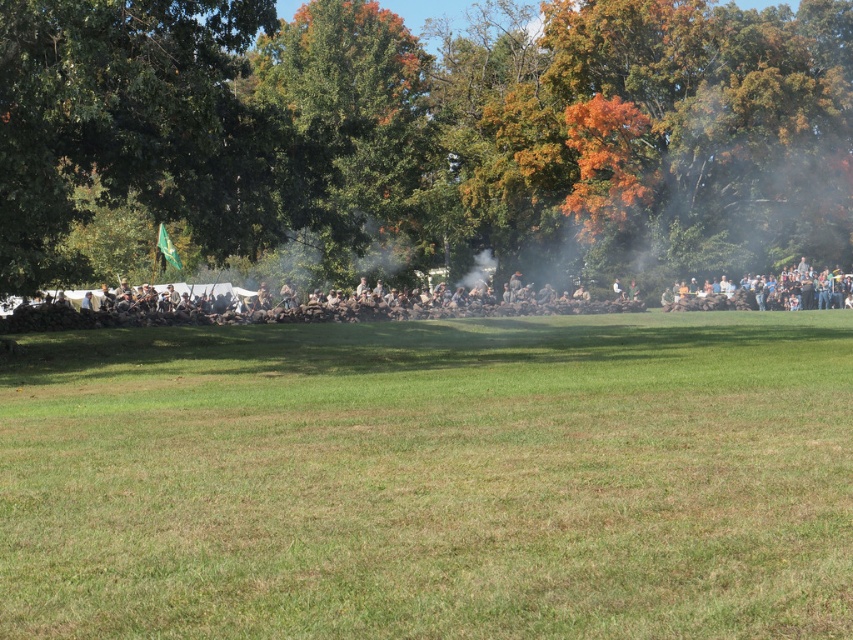
You are a photographer trying to capture a photo of the green leafy tree at upper center and the brown fabric uniform at center. Since you want both subjects to be in focus, you need to adjust your camera settings. Considering their heights, which subject should you focus on first to ensure proper depth of field?

The green leafy tree at upper center is taller than the brown fabric uniform at center, so you should focus on the green leafy tree at upper center first to ensure proper depth of field.

You are a photographer trying to capture the entire scene. You notice two green leafy trees in the image. Which tree, the green leafy tree at upper center or the green leafy tree at center, would require you to step back more to include its full width in your photo?

The green leafy tree at upper center might be wider than green leafy tree at center, so you would need to step back more to capture the full width of the green leafy tree at upper center.